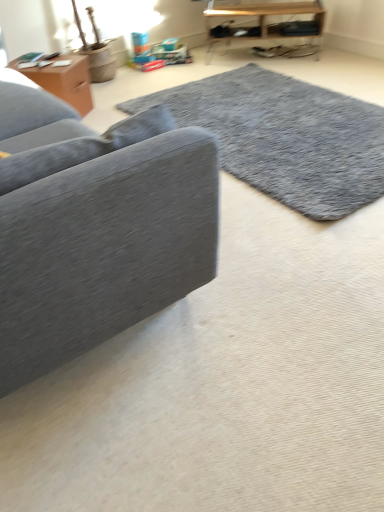
Question: Is velvet gray couch at left at the right side of wooden shelf at upper right, positioned as the 2th table in left-to-right order?

Choices:
 (A) yes
 (B) no

Answer: (B)

Question: Is velvet gray couch at left oriented away from wooden shelf at upper right, positioned as the 2th table in left-to-right order?

Choices:
 (A) yes
 (B) no

Answer: (B)

Question: Is velvet gray couch at left not near wooden shelf at upper right, the 1th table in the right-to-left sequence?

Choices:
 (A) no
 (B) yes

Answer: (B)

Question: Does velvet gray couch at left have a lesser height compared to wooden shelf at upper right, acting as the 1th table starting from the top?

Choices:
 (A) yes
 (B) no

Answer: (B)

Question: Is velvet gray couch at left facing towards wooden shelf at upper right, acting as the 1th table starting from the top?

Choices:
 (A) no
 (B) yes

Answer: (B)

Question: Do you think velvet gray couch at left is within gray shaggy rug at center, or outside of it?

Choices:
 (A) outside
 (B) inside

Answer: (A)

Question: Would you say velvet gray couch at left is to the left or to the right of gray shaggy rug at center in the picture?

Choices:
 (A) left
 (B) right

Answer: (A)

Question: Is velvet gray couch at left bigger or smaller than gray shaggy rug at center?

Choices:
 (A) big
 (B) small

Answer: (A)

Question: Looking at their shapes, would you say velvet gray couch at left is wider or thinner than gray shaggy rug at center?

Choices:
 (A) wide
 (B) thin

Answer: (B)

Question: From a real-world perspective, relative to matte brown wooden table at upper left, which ranks as the first table in front-to-back order, is velvet gray couch at left vertically above or below?

Choices:
 (A) below
 (B) above

Answer: (B)

Question: Considering the positions of velvet gray couch at left and matte brown wooden table at upper left, the 2th table from the right, in the image, is velvet gray couch at left taller or shorter than matte brown wooden table at upper left, the 2th table from the right,?

Choices:
 (A) short
 (B) tall

Answer: (B)

Question: Is velvet gray couch at left wider or thinner than matte brown wooden table at upper left, which is the first table in bottom-to-top order?

Choices:
 (A) wide
 (B) thin

Answer: (A)

Question: Would you say velvet gray couch at left is inside or outside matte brown wooden table at upper left, which ranks as the first table in front-to-back order?

Choices:
 (A) inside
 (B) outside

Answer: (B)

Question: Is wooden shelf at upper right, acting as the 1th table starting from the top, inside or outside of matte brown wooden table at upper left, arranged as the 2th table when viewed from the top?

Choices:
 (A) inside
 (B) outside

Answer: (B)

Question: From a real-world perspective, is wooden shelf at upper right, placed as the 2th table when sorted from front to back, positioned above or below matte brown wooden table at upper left, the 2th table from the right?

Choices:
 (A) below
 (B) above

Answer: (B)